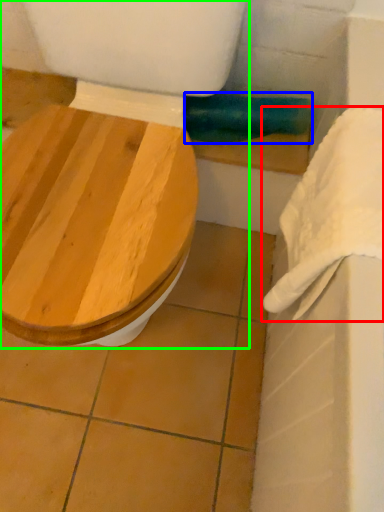
Question: Estimate the real-world distances between objects in this image. Which object is farther from towel/napkin (highlighted by a red box), towel bar (highlighted by a blue box) or toilet (highlighted by a green box)?

Choices:
 (A) towel bar
 (B) toilet

Answer: (A)